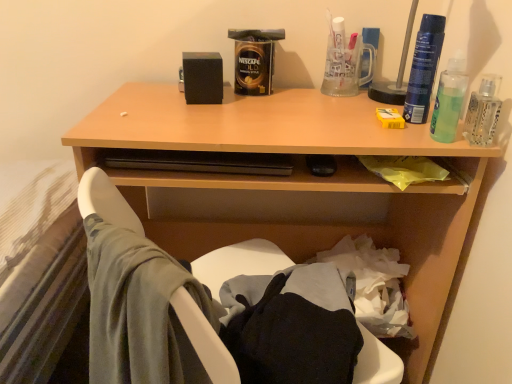
Question: Considering their positions, is green translucent liquid at upper right located in front of or behind clear glass bottle at upper right, which appears as the 2th bottle when viewed from the left?

Choices:
 (A) front
 (B) behind

Answer: (A)

Question: From the image's perspective, is green translucent liquid at upper right located above or below clear glass bottle at upper right, which appears as the 2th bottle when viewed from the left?

Choices:
 (A) above
 (B) below

Answer: (A)

Question: Which of these objects is positioned farthest from the blue plastic spray can at upper right, acting as the second bottle starting from the right?

Choices:
 (A) clear glass bottle at upper right, which appears as the 2th bottle when viewed from the left
 (B) green translucent liquid at upper right
 (C) wooden desk at upper center

Answer: (C)

Question: Estimate the real-world distances between objects in this image. Which object is farther from the clear glass bottle at upper right, which appears as the 2th bottle when viewed from the left?

Choices:
 (A) blue plastic spray can at upper right, acting as the second bottle starting from the right
 (B) wooden desk at upper center
 (C) green translucent liquid at upper right

Answer: (B)